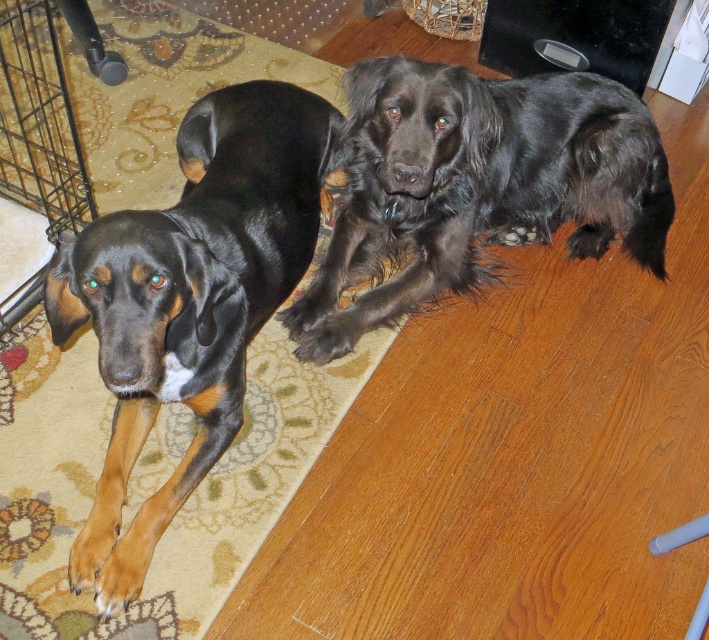
Question: Which point is farther to the camera?

Choices:
 (A) (223, 442)
 (B) (424, 180)

Answer: (B)

Question: Is black glossy dog at left wider than shiny black dog at upper right?

Choices:
 (A) yes
 (B) no

Answer: (B)

Question: Which point is farther from the camera taking this photo?

Choices:
 (A) (196, 116)
 (B) (635, 129)

Answer: (B)

Question: Among these points, which one is farthest from the camera?

Choices:
 (A) (145, 284)
 (B) (291, 305)

Answer: (B)

Question: Is black glossy dog at left further to camera compared to shiny black dog at upper right?

Choices:
 (A) no
 (B) yes

Answer: (A)

Question: Can you confirm if black glossy dog at left is positioned below shiny black dog at upper right?

Choices:
 (A) no
 (B) yes

Answer: (B)